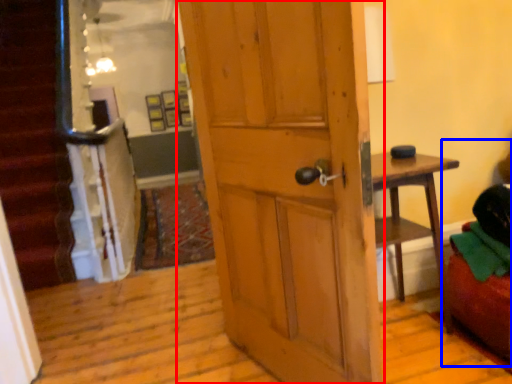
Question: Among these objects, which one is nearest to the camera, door (highlighted by a red box) or bean bag chair (highlighted by a blue box)?

Choices:
 (A) door
 (B) bean bag chair

Answer: (A)